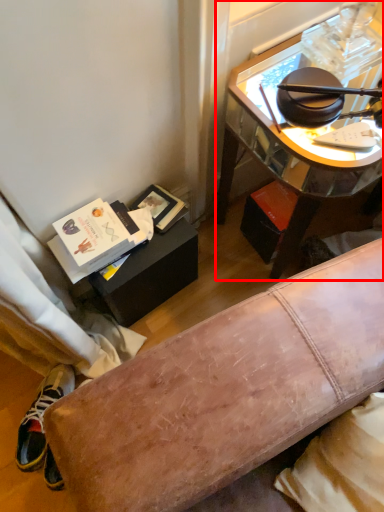
Question: From the image, what is the correct spatial relationship of desk (annotated by the red box) in relation to shoe?

Choices:
 (A) right
 (B) left

Answer: (A)